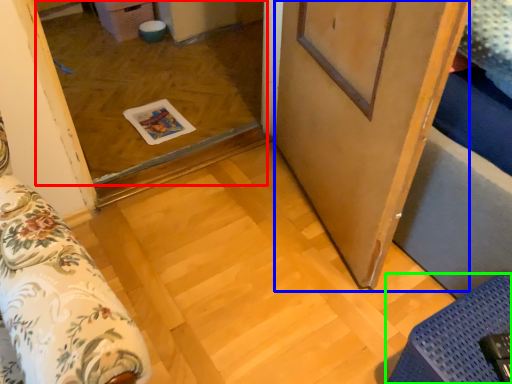
Question: Which is farther away from window (highlighted by a red box)? barn door (highlighted by a blue box) or furniture (highlighted by a green box)?

Choices:
 (A) barn door
 (B) furniture

Answer: (B)